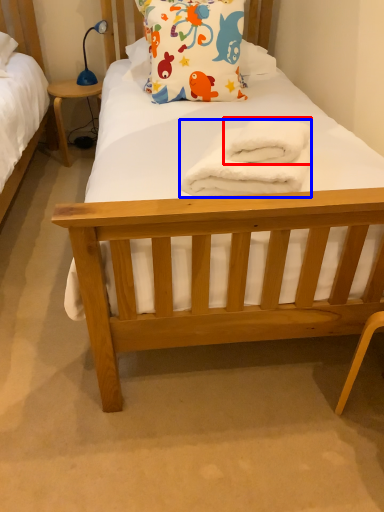
Question: Which object appears farthest to the camera in this image, bath towel (highlighted by a red box) or towel/napkin (highlighted by a blue box)?

Choices:
 (A) bath towel
 (B) towel/napkin

Answer: (A)